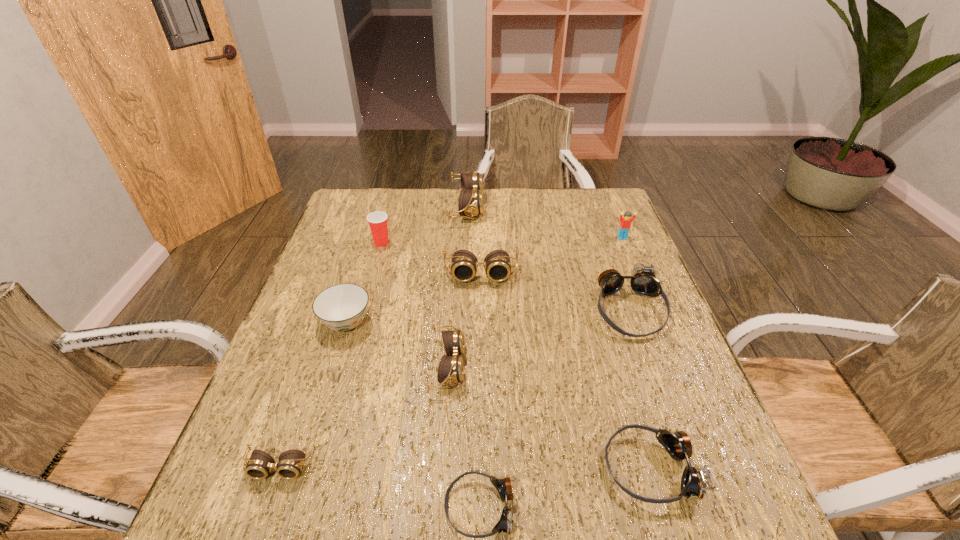
Where is `vacant region at the left edge of the desktop`? This screenshot has height=540, width=960. vacant region at the left edge of the desktop is located at coordinates (306, 449).

I want to click on blank space at the right edge, so click(x=630, y=296).

Where is `vacant space at the far left corner of the desktop`? vacant space at the far left corner of the desktop is located at coordinates (391, 197).

At what (x,y) coordinates should I click in order to perform the action: click on free point at the far right corner. Please return your answer as a coordinate pair (x, y). This screenshot has width=960, height=540. Looking at the image, I should click on (620, 208).

Identify the location of free space between the second smallest bronze goggles and the farthest bronze goggles. (639, 389).

Find the location of a particular element. free spot between the second smallest brown goggles and the red Lego is located at coordinates (535, 301).

Image resolution: width=960 pixels, height=540 pixels. Identify the location of vacant area that lies between the farthest brown goggles and the second farthest brown goggles. (473, 241).

Identify the location of vacant area that lies between the second biggest brown goggles and the soup bowl. (414, 299).

At what (x,y) coordinates should I click in order to perform the action: click on free space that is in between the soup bowl and the farthest object. Please return your answer as a coordinate pair (x, y). This screenshot has height=540, width=960. Looking at the image, I should click on pos(406,265).

The image size is (960, 540). I want to click on empty location between the third biggest brown goggles and the smallest brown goggles, so point(364,416).